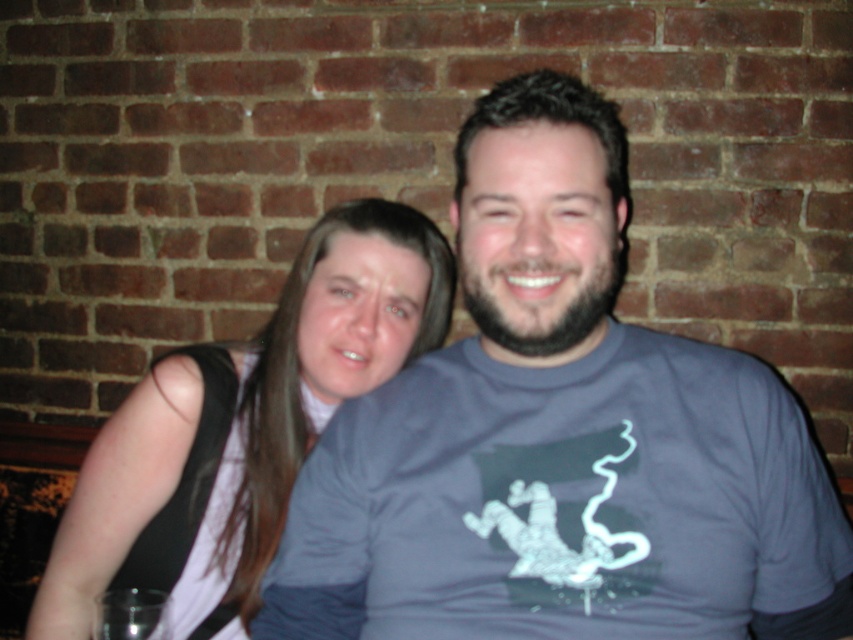
Question: Does gray matte t-shirt at center have a greater width compared to white matte shirt at center?

Choices:
 (A) no
 (B) yes

Answer: (B)

Question: Does gray matte t-shirt at center have a lesser width compared to white matte shirt at center?

Choices:
 (A) no
 (B) yes

Answer: (A)

Question: Which of the following is the farthest from the observer?

Choices:
 (A) gray matte t-shirt at center
 (B) white matte shirt at center

Answer: (B)

Question: Which object is farther from the camera taking this photo?

Choices:
 (A) white matte shirt at center
 (B) gray matte t-shirt at center

Answer: (A)

Question: Is gray matte t-shirt at center to the left of white matte shirt at center from the viewer's perspective?

Choices:
 (A) yes
 (B) no

Answer: (B)